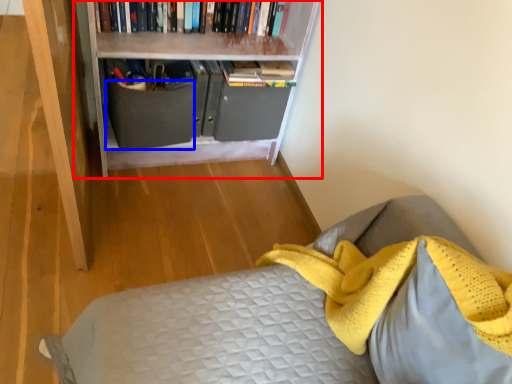
Question: Which point is closer to the camera, bookcase (highlighted by a red box) or drawer (highlighted by a blue box)?

Choices:
 (A) bookcase
 (B) drawer

Answer: (A)